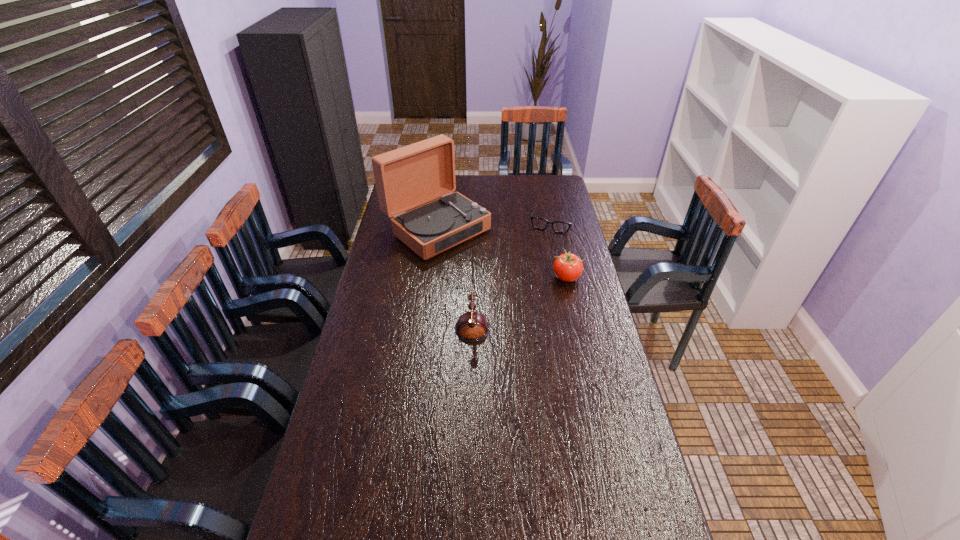
Image resolution: width=960 pixels, height=540 pixels. Identify the location of free space located 0.250m on the front-facing side of the spectacles. (537, 267).

The height and width of the screenshot is (540, 960). What are the coordinates of `vacant space located 0.060m on the face of the phonograph record` in the screenshot? It's located at (480, 260).

At what (x,y) coordinates should I click in order to perform the action: click on free region located on the face of the phonograph record. Please return your answer as a coordinate pair (x, y). Looking at the image, I should click on (503, 278).

Locate an element on the screen. This screenshot has height=540, width=960. vacant space located 0.330m on the face of the phonograph record is located at coordinates (524, 294).

At what (x,y) coordinates should I click in order to perform the action: click on object at the left edge. Please return your answer as a coordinate pair (x, y). The width and height of the screenshot is (960, 540). Looking at the image, I should click on (407, 177).

Where is `tomato that is at the right edge`? This screenshot has width=960, height=540. tomato that is at the right edge is located at coordinates (567, 267).

Identify the location of spectacles at the right edge. (539, 223).

Locate an element on the screen. free region at the far edge is located at coordinates (499, 194).

In the image, there is a desktop. Identify the location of vacant area at the left edge. (367, 365).

Where is `free space at the right edge`? free space at the right edge is located at coordinates (621, 431).